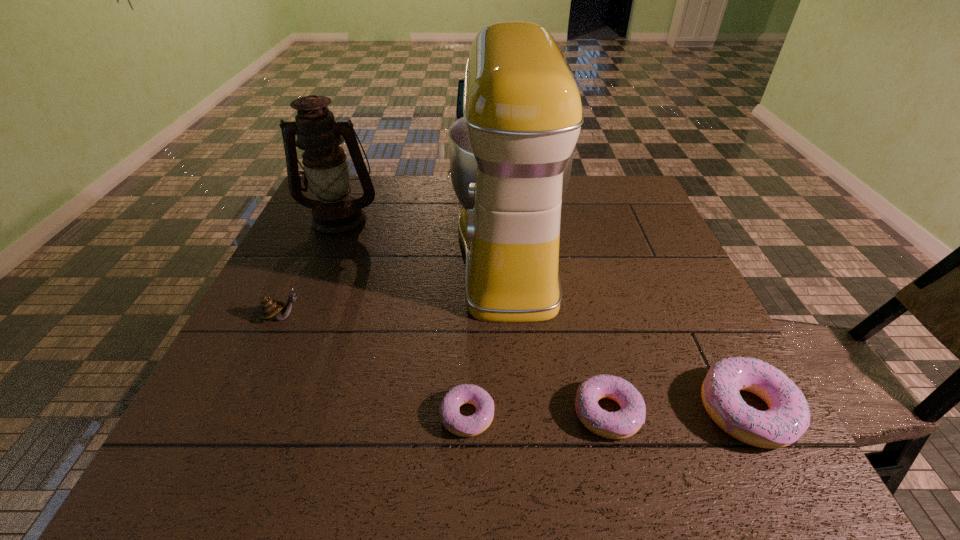
Identify the location of vacant space that's between the shortest object and the mixer. (488, 334).

You are a GUI agent. You are given a task and a screenshot of the screen. Output one action in this format:
    pyautogui.click(x=<x>, y=<y>)
    Task: Click on the vacant space that's between the tallest object and the rightmost object
    This screenshot has width=960, height=540.
    Given the screenshot: What is the action you would take?
    pyautogui.click(x=627, y=331)

The image size is (960, 540). In order to click on vacant space that is in between the tallest doughnut and the second tallest doughnut in this screenshot , I will do `click(677, 411)`.

Identify the location of vacant area between the mixer and the fourth shortest object. The width and height of the screenshot is (960, 540). (396, 285).

This screenshot has height=540, width=960. In order to click on free space that is in between the rightmost doughnut and the snail in this screenshot , I will do `click(515, 363)`.

Locate an element on the screen. The image size is (960, 540). free point between the lantern and the fourth shortest object is located at coordinates [x=312, y=268].

Find the location of `vacant space that's between the fifth tallest object and the third shortest object`. vacant space that's between the fifth tallest object and the third shortest object is located at coordinates (677, 411).

Find the location of a particular element. The image size is (960, 540). free space between the second doughnut from right to left and the shortest object is located at coordinates (537, 414).

Select which object is the second closest to the snail. Please provide its 2D coordinates. Your answer should be formatted as a tuple, i.e. [(x, y)], where the tuple contains the x and y coordinates of a point satisfying the conditions above.

[(511, 154)]

In order to click on object that is the second closest to the second shortest object in this screenshot , I will do `click(465, 426)`.